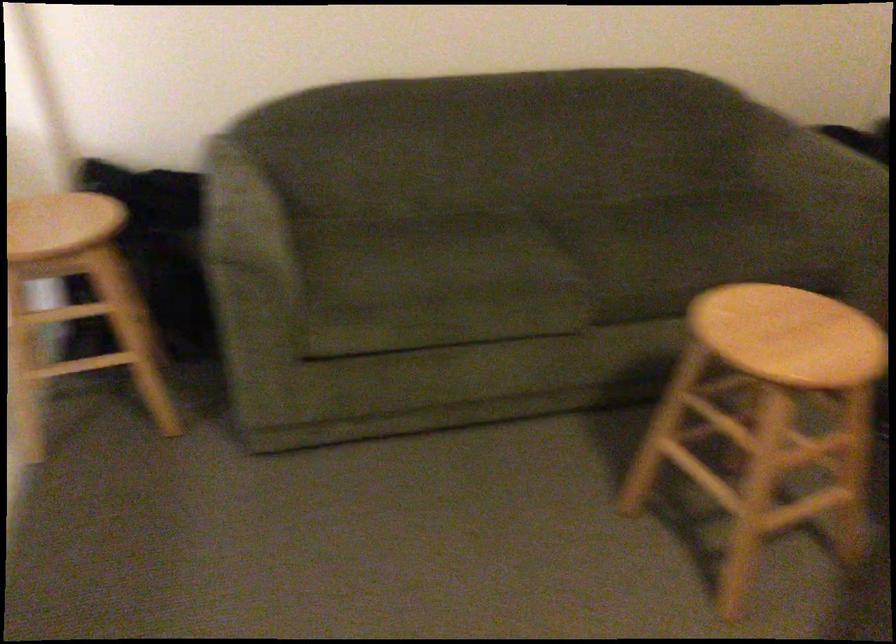
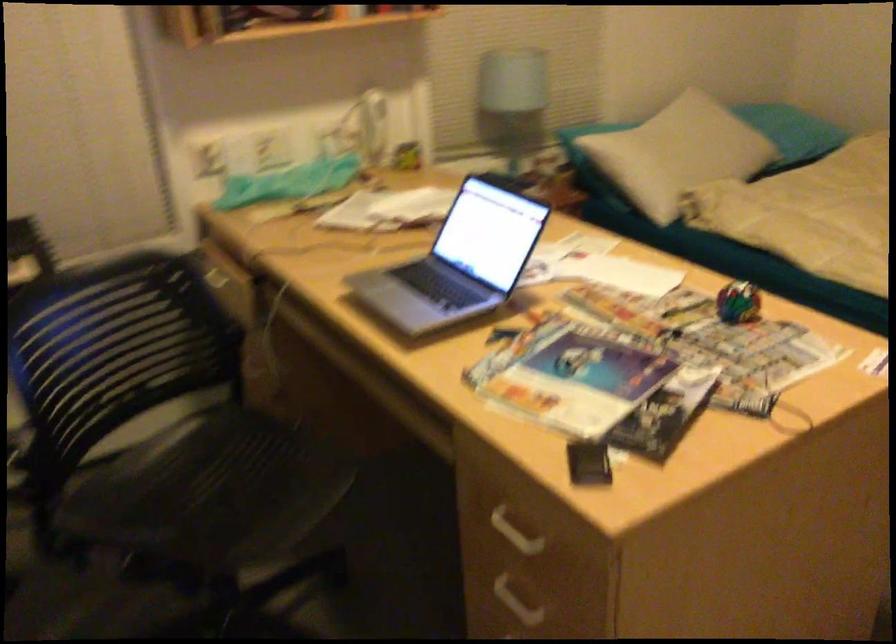
The images are taken continuously from a first-person perspective. In which direction is your viewpoint rotating?

The rotation direction of the camera is right-down.